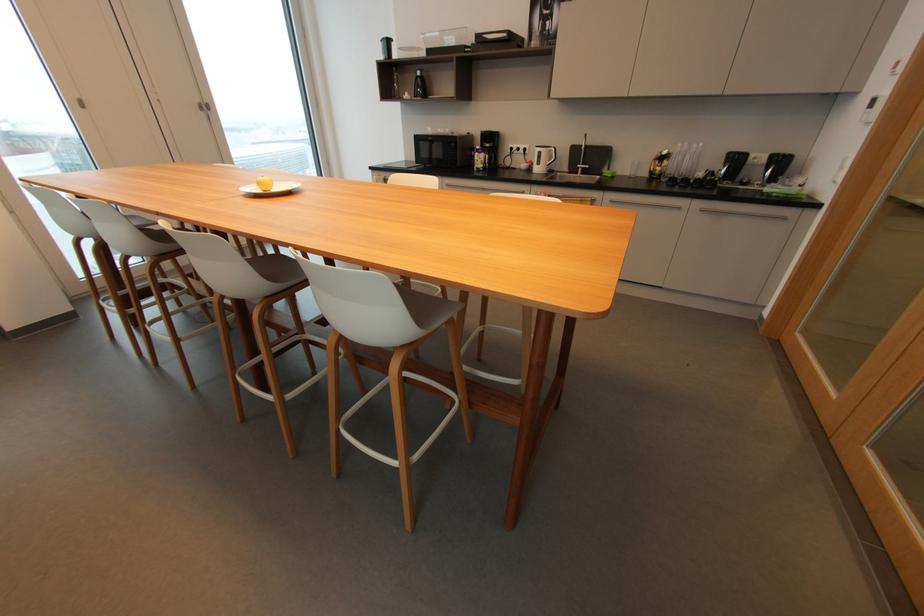
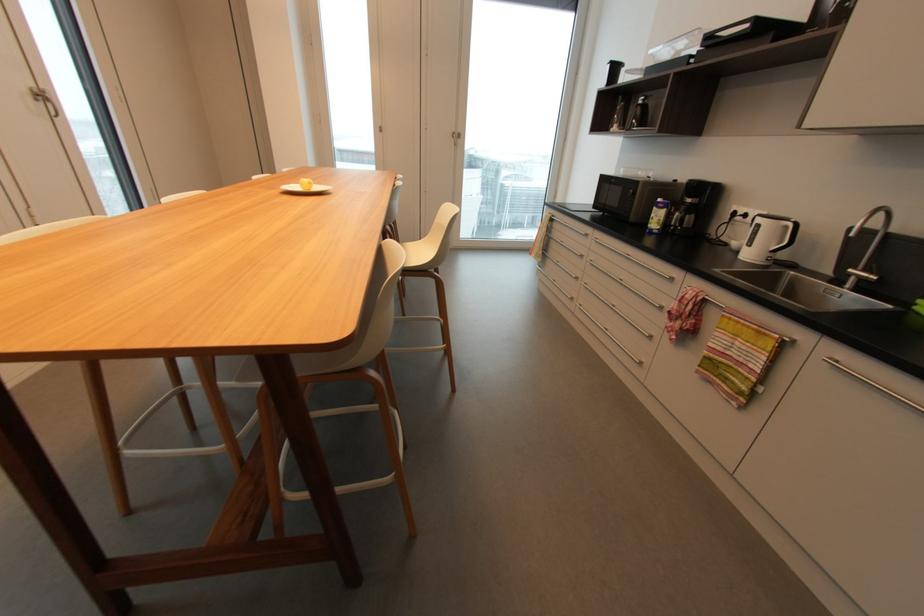
In the second image, find the point that corresponds to pixel 554 151 in the first image.

(789, 227)